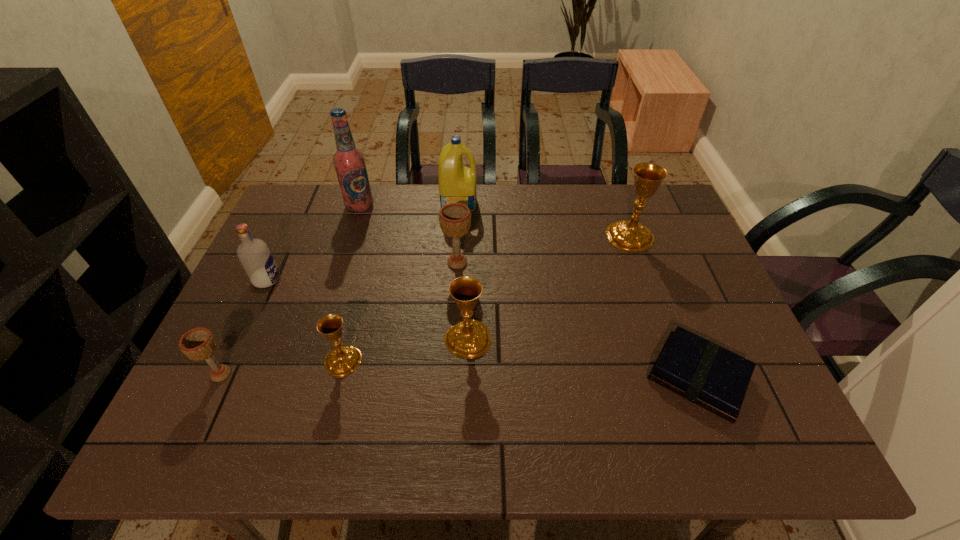
At what (x,y) coordinates should I click in order to perform the action: click on object that is the sixth nearest to the shortest object. Please return your answer as a coordinate pair (x, y). This screenshot has width=960, height=540. Looking at the image, I should click on (349, 162).

Identify which chalice is located as the third nearest to the leftmost chalice. Please provide its 2D coordinates. Your answer should be formatted as a tuple, i.e. [(x, y)], where the tuple contains the x and y coordinates of a point satisfying the conditions above.

[(455, 218)]

Point out which chalice is positioned as the second nearest to the left beige chalice. Please provide its 2D coordinates. Your answer should be formatted as a tuple, i.e. [(x, y)], where the tuple contains the x and y coordinates of a point satisfying the conditions above.

[(470, 338)]

Where is `gold chalice that is the second closest to the rightmost gold chalice`? The image size is (960, 540). gold chalice that is the second closest to the rightmost gold chalice is located at coordinates (343, 360).

This screenshot has height=540, width=960. Identify the location of gold chalice that is the third nearest to the shortest object. (343, 360).

At what (x,y) coordinates should I click in order to perform the action: click on vacant space that satisfies the following two spatial constraints: 1. on the label of the detergent; 2. on the left side of the book. Please return your answer as a coordinate pair (x, y). Looking at the image, I should click on (448, 377).

This screenshot has height=540, width=960. I want to click on free space in the image that satisfies the following two spatial constraints: 1. on the label of the book; 2. on the right side of the vodka, so click(x=222, y=377).

Locate an element on the screen. Image resolution: width=960 pixels, height=540 pixels. vacant space that satisfies the following two spatial constraints: 1. on the back side of the second chalice from left to right; 2. on the right side of the second gold chalice from right to left is located at coordinates (348, 339).